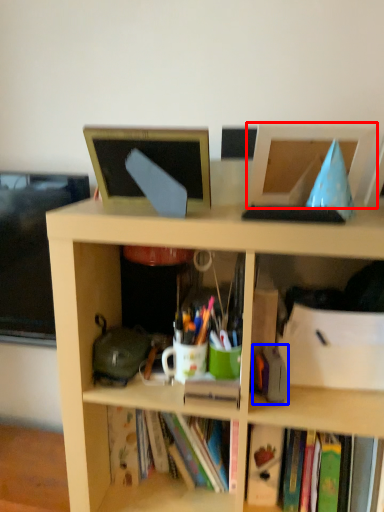
Question: Which object is closer to the camera taking this photo, computer monitor (highlighted by a red box) or stationery (highlighted by a blue box)?

Choices:
 (A) computer monitor
 (B) stationery

Answer: (A)